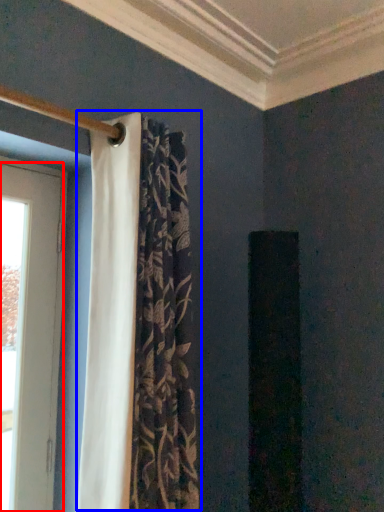
Question: Among these objects, which one is farthest to the camera, door (highlighted by a red box) or curtain (highlighted by a blue box)?

Choices:
 (A) door
 (B) curtain

Answer: (A)